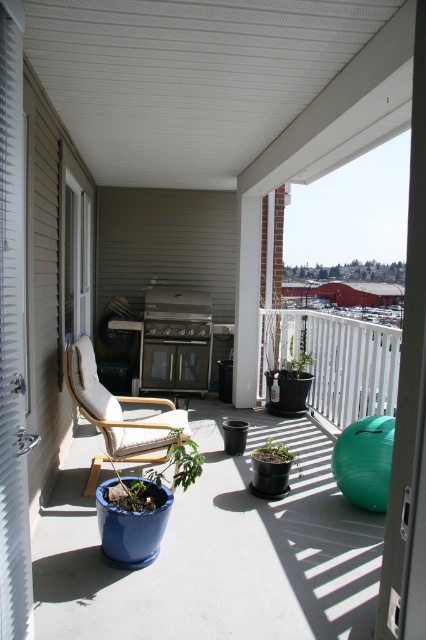
You are a delivery person trying to place a large package that is 3 meters long on the balcony. The package needs to be placed between the stainless steel grill at center and the matte blue pot at center. Is there enough space for the package between them?

The distance between the stainless steel grill at center and the matte blue pot at center is 2.96 meters. Since the package is 3 meters long, it is slightly longer than the available space. Therefore, there isn not enough space to place the package between them.

You are standing on the balcony and want to sit in the white fabric armchair at center. Which direction should you move to reach it?

Since the white fabric armchair at center is located at coordinates approximately 0.650 on the x axis and 0.279 on the y axis, you should move towards the center of the balcony to reach it.

You are hosting a barbecue on the balcony and need to move a 6.5 feet long grill cover from the white fabric armchair at center to the stainless steel grill at center. Can you move it without folding the cover?

The distance between the white fabric armchair at center and the stainless steel grill at center is 7.66 feet. Since the grill cover is 6.5 feet long, it can be moved without folding as the distance is greater than the cover length.